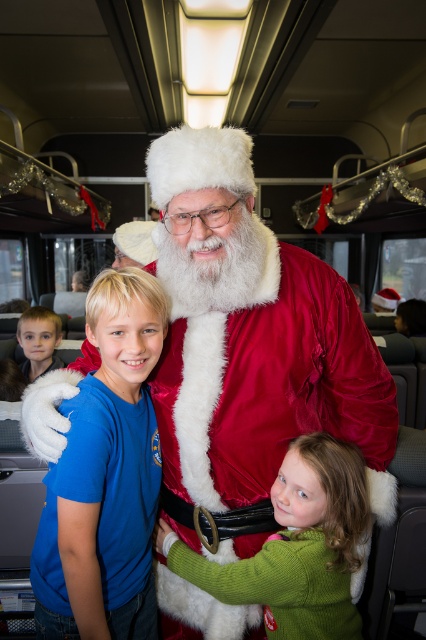
Question: Estimate the real-world distances between objects in this image. Which object is farther from the blue cotton shirt at center?

Choices:
 (A) green fuzzy sweater at lower center
 (B) velvet red santa at center

Answer: (A)

Question: Which point appears farthest from the camera in this image?

Choices:
 (A) (37, 368)
 (B) (127, 403)
 (C) (270, 620)
 (D) (253, 406)

Answer: (A)

Question: Which object is farther from the camera taking this photo?

Choices:
 (A) green fuzzy sweater at lower center
 (B) light brown hair at left
 (C) velvet red santa at center

Answer: (B)

Question: Is the position of velvet red santa at center less distant than that of blue cotton shirt at center?

Choices:
 (A) no
 (B) yes

Answer: (A)

Question: Considering the relative positions of velvet red santa at center and green fuzzy sweater at lower center in the image provided, where is velvet red santa at center located with respect to green fuzzy sweater at lower center?

Choices:
 (A) above
 (B) below

Answer: (A)

Question: Can you confirm if velvet red santa at center is wider than blue cotton shirt at center?

Choices:
 (A) no
 (B) yes

Answer: (B)